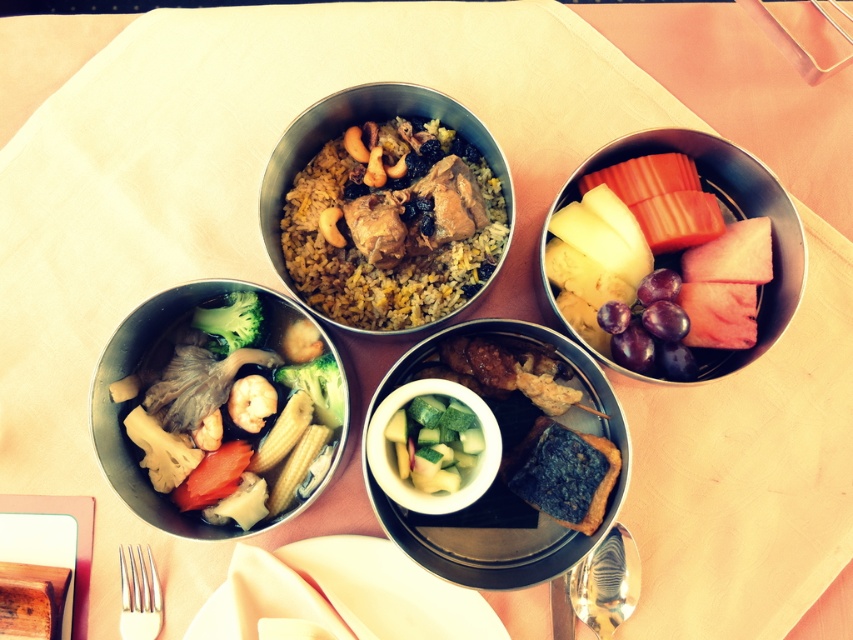
You are sitting at the dining table and want to reach for the fruits in the top right compartment. Which point, point (636, 598) or point (207, 324), is closer to you when reaching for the fruits?

Point (636, 598) is closer to you because it is in front of point (207, 324).

You have a metallic silver bowl at upper right and a shiny metallic spoon at bottom right. Which object is larger in size?

The metallic silver bowl at upper right is bigger than the shiny metallic spoon at bottom right.

You are a photographer holding a camera at the center of the dining table. You want to capture a closeup shot of the metallic silver bowl at upper right. Based on the distance between the camera and the bowl, can you estimate whether you need to adjust your position to get a clear focus? Please explain your reasoning.

The metallic silver bowl at upper right is 25.63 inches away from the camera. Since this distance is within a typical focusing range for most cameras, you can likely achieve clear focus without needing to move. Ensure the camera is properly focused on the bowl.